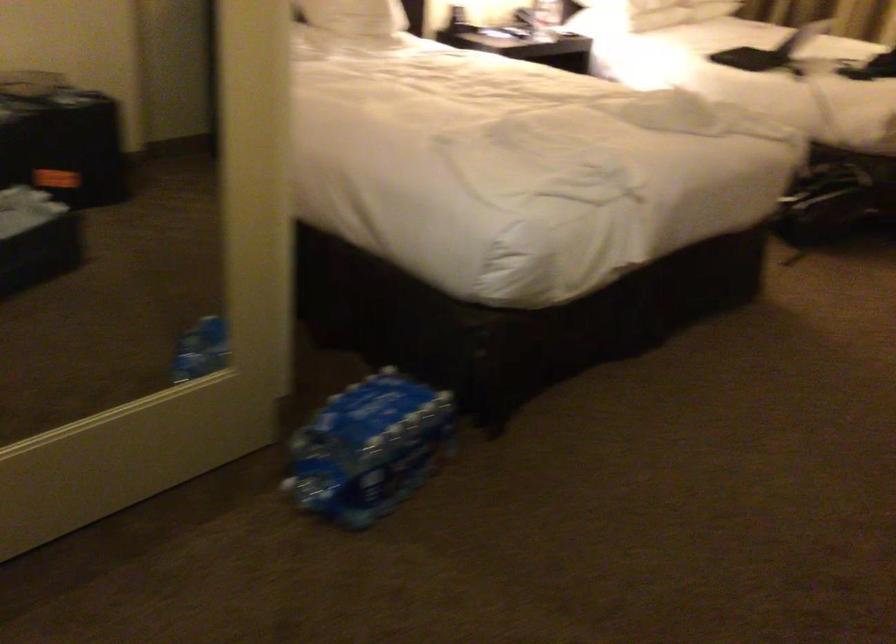
This screenshot has width=896, height=644. What are the coordinates of `case of water bottles` in the screenshot? It's located at (367, 448).